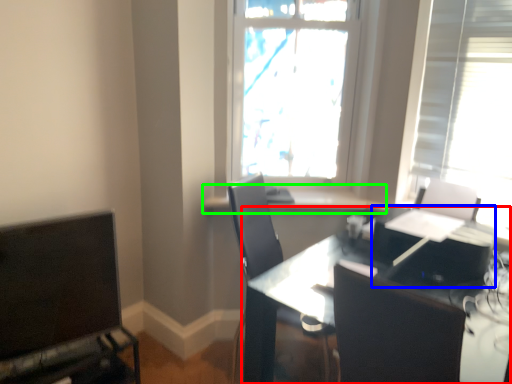
Question: Considering the real-world distances, which object is closest to table (highlighted by a red box)? computer (highlighted by a blue box) or window sill (highlighted by a green box).

Choices:
 (A) computer
 (B) window sill

Answer: (A)